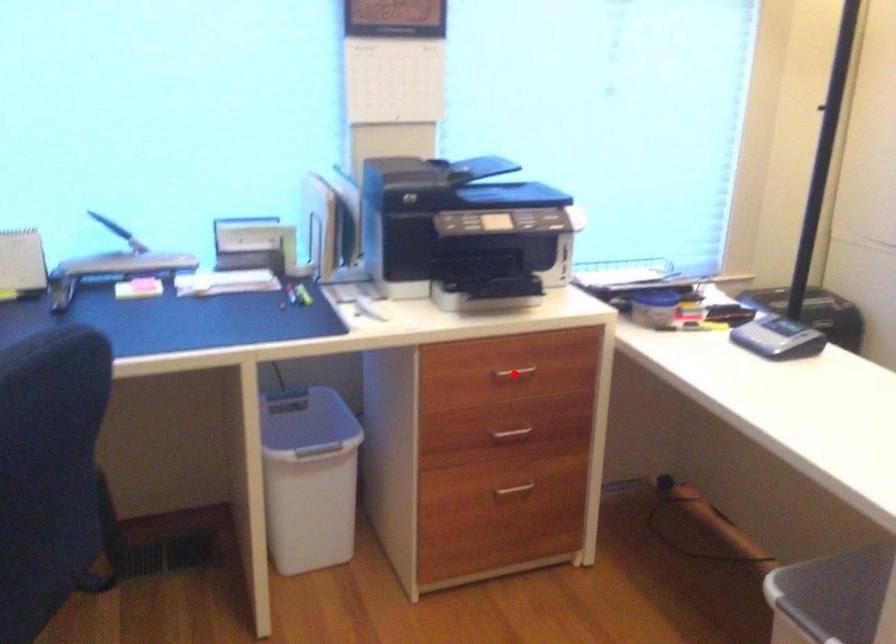
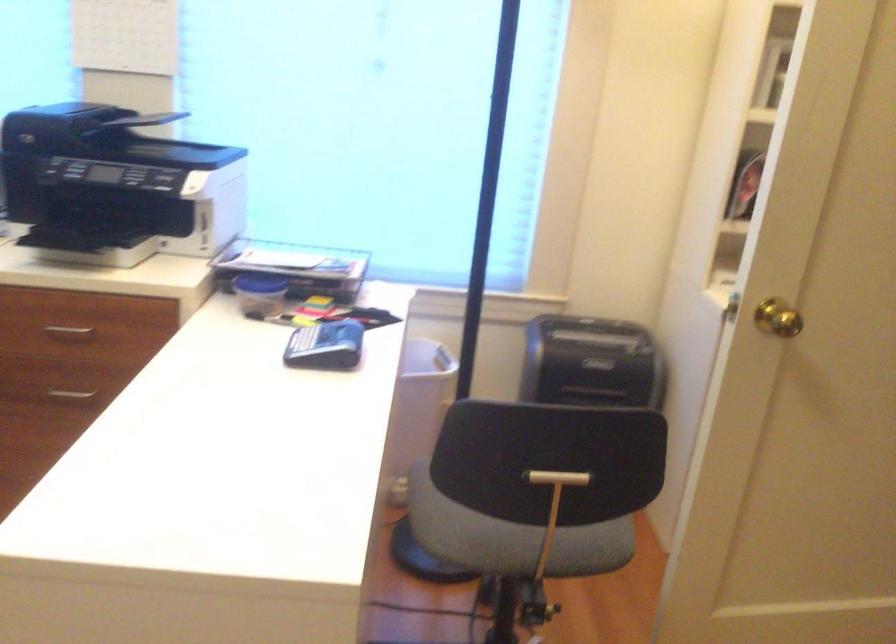
The point at the highlighted location is marked in the first image. Where is the corresponding point in the second image?

(69, 332)